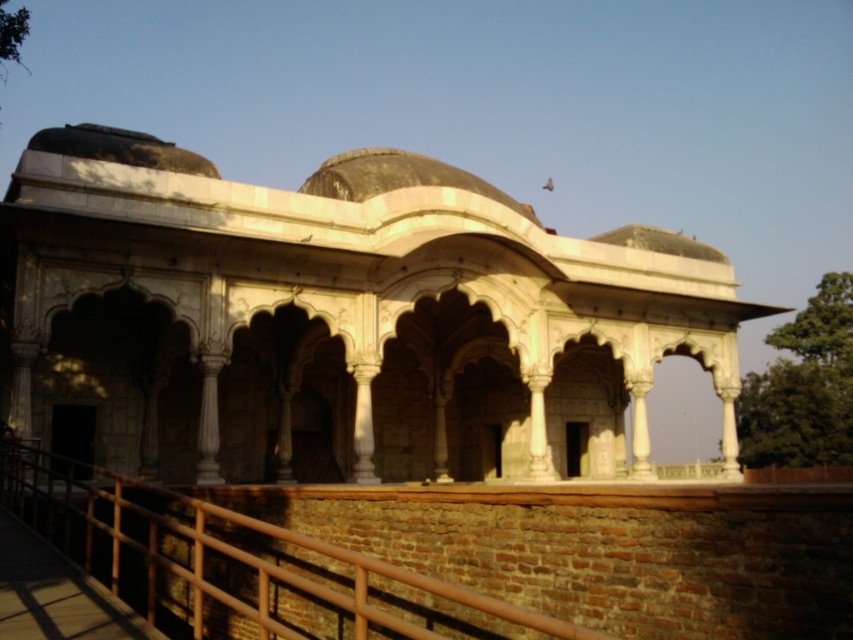
Question: Can you confirm if white marble palace at center is positioned below brown wood railing at lower center?

Choices:
 (A) no
 (B) yes

Answer: (A)

Question: In this image, where is white marble palace at center located relative to brown wood railing at lower center?

Choices:
 (A) below
 (B) above

Answer: (B)

Question: Which object is closer to the camera taking this photo?

Choices:
 (A) white marble palace at center
 (B) brown wood railing at lower center

Answer: (B)

Question: Is white marble palace at center thinner than brown wood railing at lower center?

Choices:
 (A) no
 (B) yes

Answer: (A)